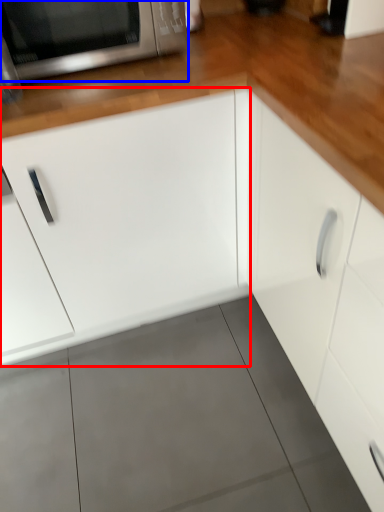
Question: Which object appears closest to the camera in this image, cabinetry (highlighted by a red box) or microwave oven (highlighted by a blue box)?

Choices:
 (A) cabinetry
 (B) microwave oven

Answer: (A)